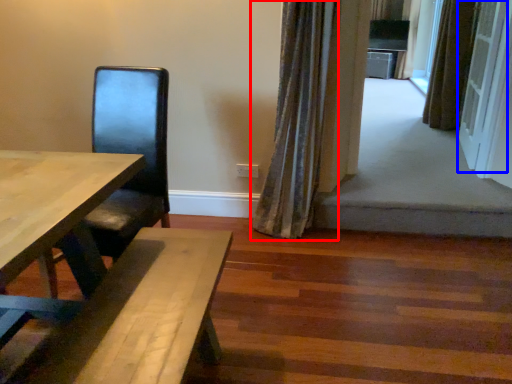
Question: Among these objects, which one is nearest to the camera, curtain (highlighted by a red box) or screen door (highlighted by a blue box)?

Choices:
 (A) curtain
 (B) screen door

Answer: (A)